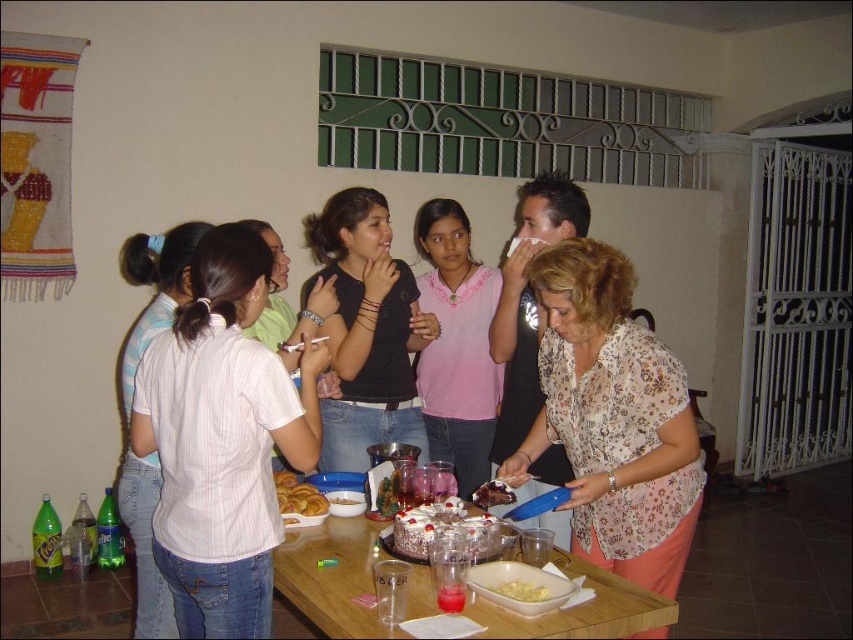
Question: Is matte white cake at center thinner than wooden table at center?

Choices:
 (A) yes
 (B) no

Answer: (A)

Question: Is white glossy cake at center to the right of white frosted cake at center from the viewer's perspective?

Choices:
 (A) no
 (B) yes

Answer: (B)

Question: Can you confirm if floral sheer blouse at center is thinner than black matte shirt at center?

Choices:
 (A) yes
 (B) no

Answer: (B)

Question: Among these objects, which one is nearest to the camera?

Choices:
 (A) yellow creamy pasta at lower center
 (B) golden brown doughnut at center
 (C) floral sheer blouse at center

Answer: (A)

Question: Which of the following is the farthest from the observer?

Choices:
 (A) (622, 572)
 (B) (157, 612)

Answer: (B)

Question: Which point is closer to the camera?

Choices:
 (A) (664, 476)
 (B) (527, 598)
 (C) (351, 397)
 (D) (437, 272)

Answer: (B)